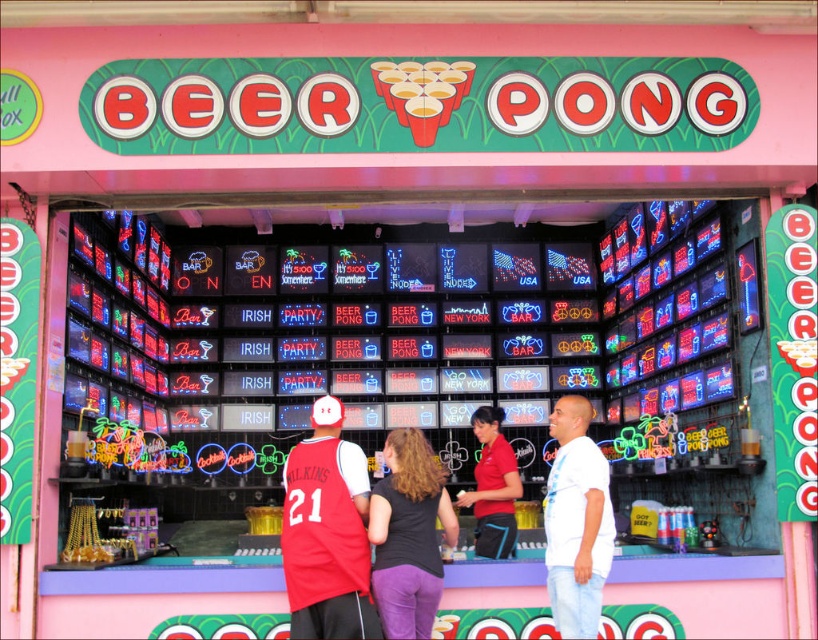
Is red jersey at center to the left of white cotton shirt at center from the viewer's perspective?

Yes, red jersey at center is to the left of white cotton shirt at center.

Can you confirm if red jersey at center is smaller than white cotton shirt at center?

No, red jersey at center is not smaller than white cotton shirt at center.

Does point (333, 620) come behind point (560, 528)?

That is False.

Identify the location of red jersey at center. The image size is (818, 640). (327, 532).

Does white cotton shirt at center have a lesser height compared to red fabric shirt at center?

In fact, white cotton shirt at center may be taller than red fabric shirt at center.

Is point (567, 602) positioned in front of point (493, 545)?

Yes, point (567, 602) is closer to viewer.

You are a GUI agent. You are given a task and a screenshot of the screen. Output one action in this format:
    pyautogui.click(x=<x>, y=<y>)
    Task: Click on the white cotton shirt at center
    
    Given the screenshot: What is the action you would take?
    pyautogui.click(x=576, y=522)

How distant is black fabric shirt at center from red fabric shirt at center?

black fabric shirt at center is 8.01 feet away from red fabric shirt at center.

Which is below, black fabric shirt at center or red fabric shirt at center?

black fabric shirt at center is below.

Is point (393, 563) in front of point (483, 540)?

Yes.

At what (x,y) coordinates should I click in order to perform the action: click on black fabric shirt at center. Please return your answer as a coordinate pair (x, y). Looking at the image, I should click on (409, 534).